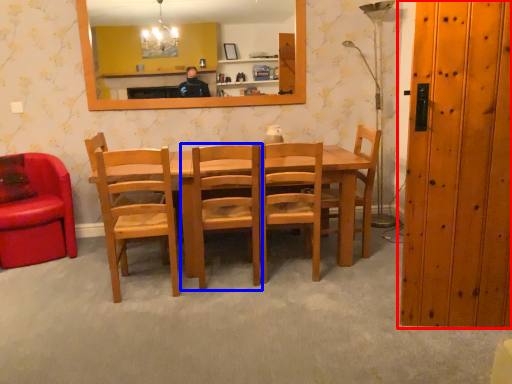
Question: Which object is closer to the camera taking this photo, door (highlighted by a red box) or chair (highlighted by a blue box)?

Choices:
 (A) door
 (B) chair

Answer: (A)